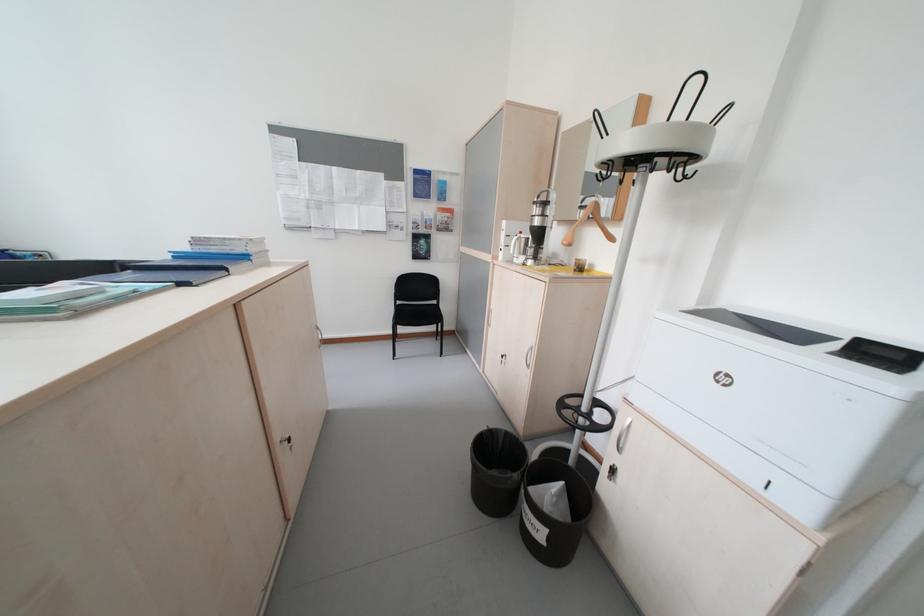
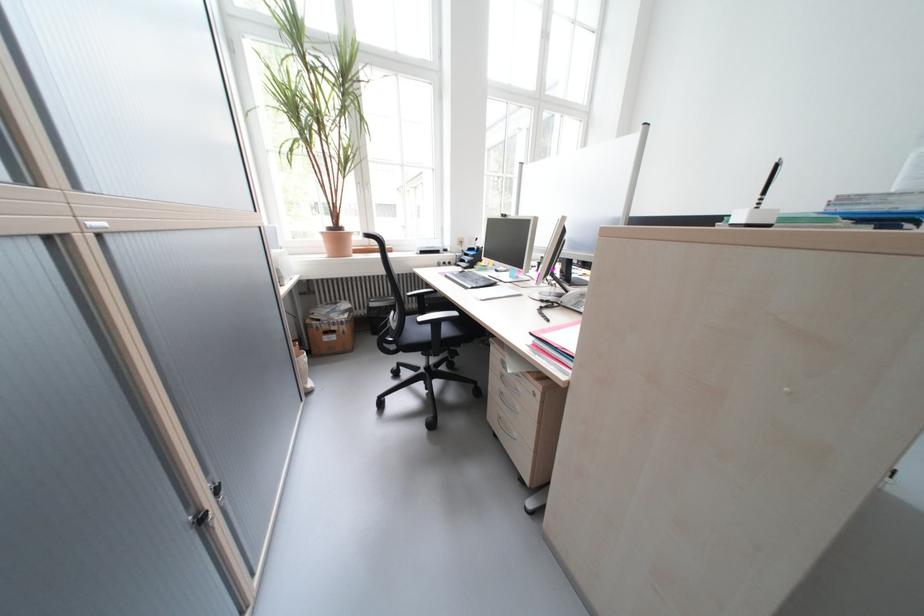
Question: How did the camera likely rotate?

Choices:
 (A) Left
 (B) Right
 (C) Up
 (D) Down

Answer: (A)